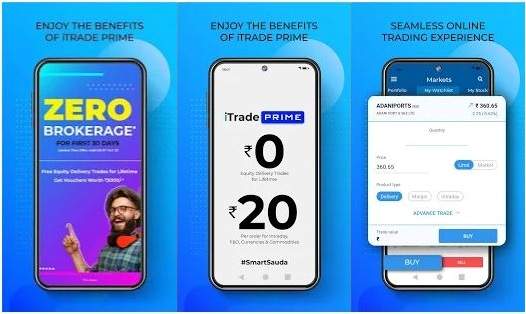
This screenshot has width=526, height=314. In order to click on phone in this screenshot , I will do `click(79, 207)`.